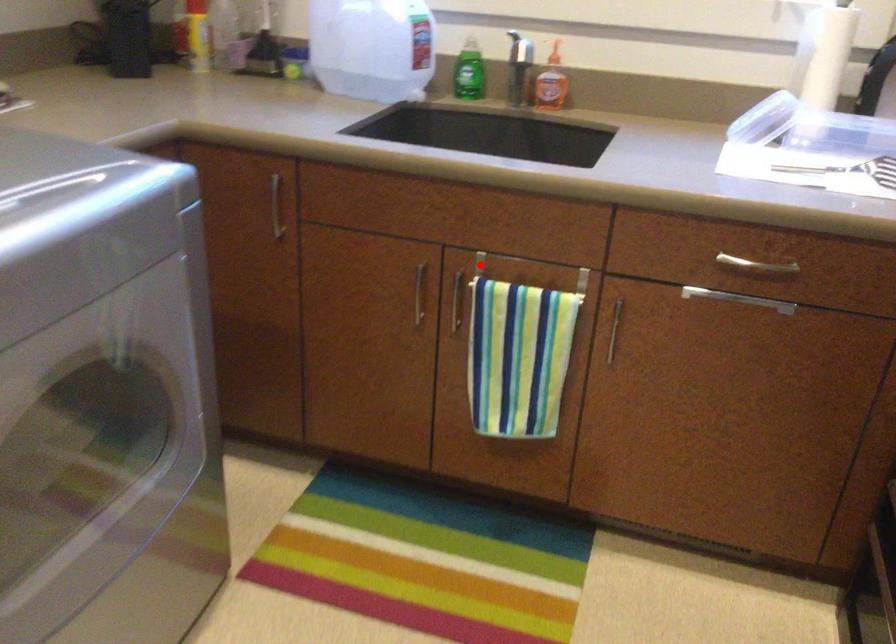
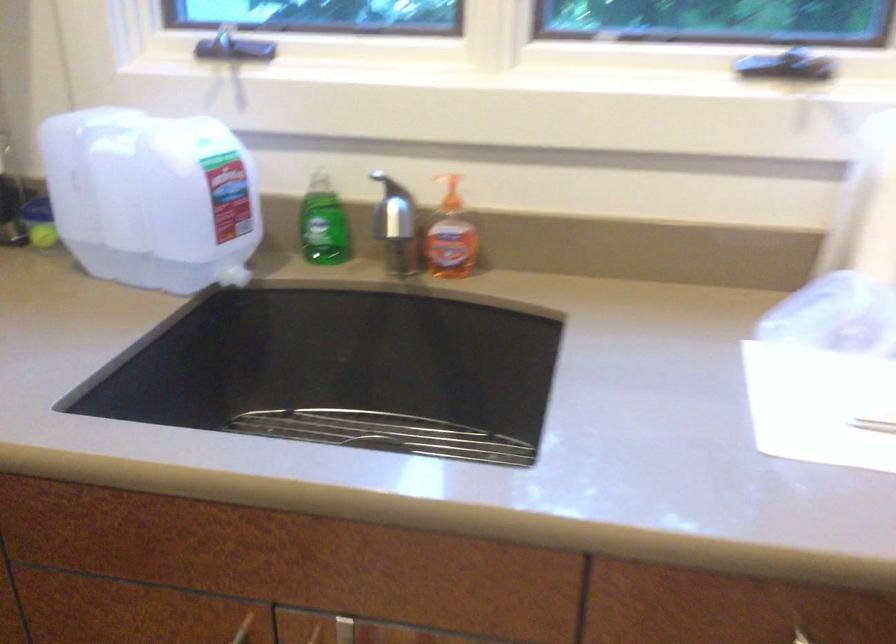
Question: A red point is marked in image1. In image2, is the corresponding 3D point closer to the camera or farther? Reply with the corresponding letter.

Choices:
 (A) The corresponding 3D point is closer.
 (B) The corresponding 3D point is farther.

Answer: (A)